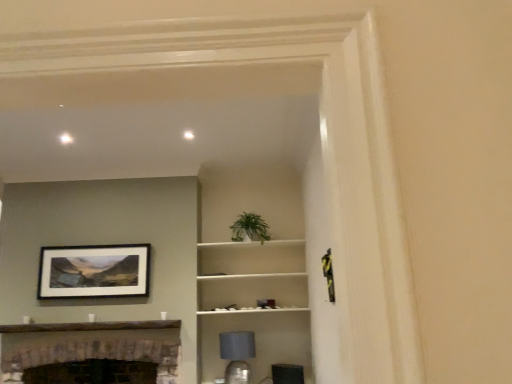
Question: Visually, is white matte shelf at center positioned to the left or to the right of brick fireplace at lower left?

Choices:
 (A) left
 (B) right

Answer: (B)

Question: From a real-world perspective, is white matte shelf at center physically located above or below brick fireplace at lower left?

Choices:
 (A) below
 (B) above

Answer: (B)

Question: Which object is the farthest from the matte gray lampshade at lower center?

Choices:
 (A) green leafy plant at center
 (B) brick fireplace at lower left
 (C) white matte shelf at center
 (D) matte black picture frame at upper left

Answer: (D)

Question: Which object is the closest to the green leafy plant at center?

Choices:
 (A) matte black picture frame at upper left
 (B) brick fireplace at lower left
 (C) white matte shelf at center
 (D) matte gray lampshade at lower center

Answer: (C)